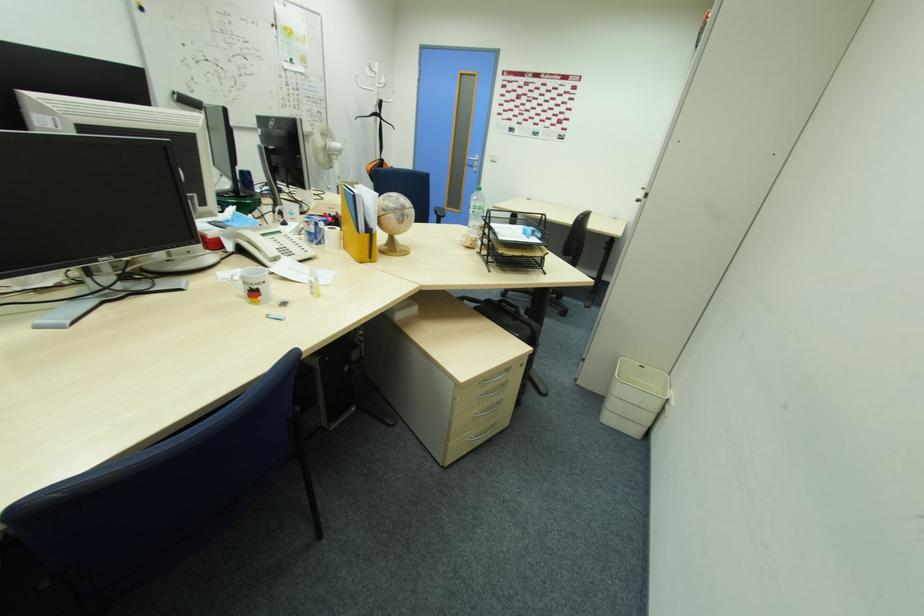
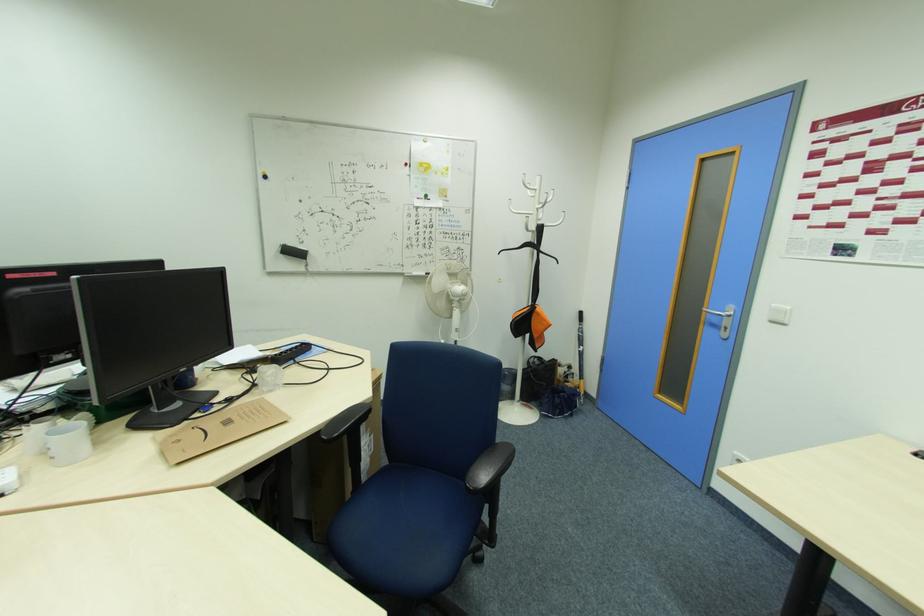
Locate, in the second image, the point that corresponds to point 335,209 in the first image.

(232, 424)